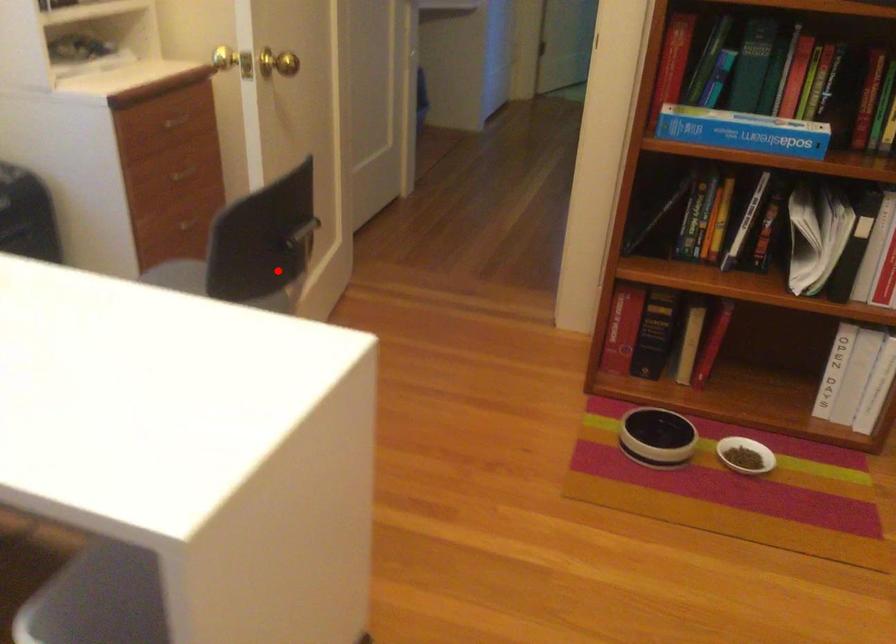
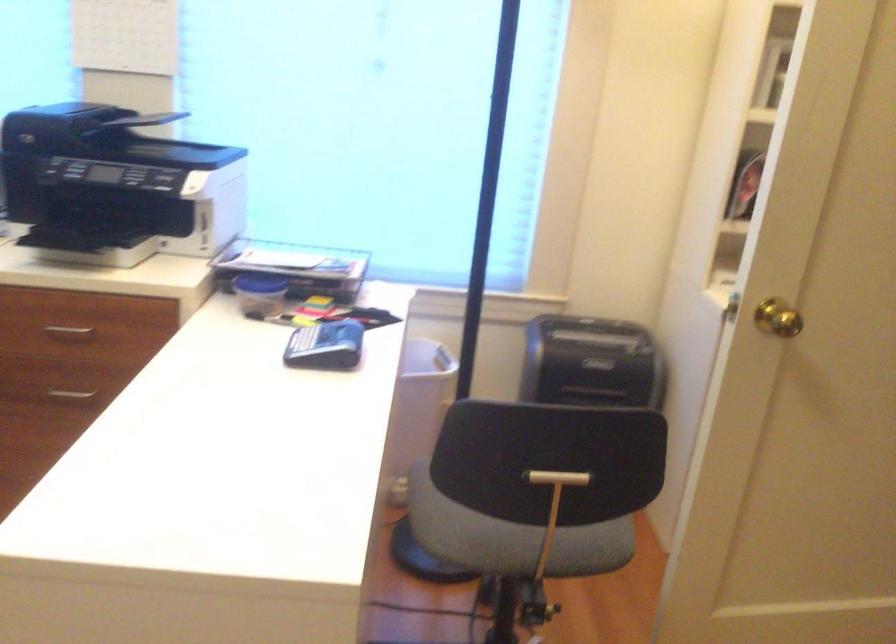
Question: A red point is marked in image1. In image2, is the corresponding 3D point closer to the camera or farther? Reply with the corresponding letter.

Choices:
 (A) The corresponding 3D point is closer.
 (B) The corresponding 3D point is farther.

Answer: (A)